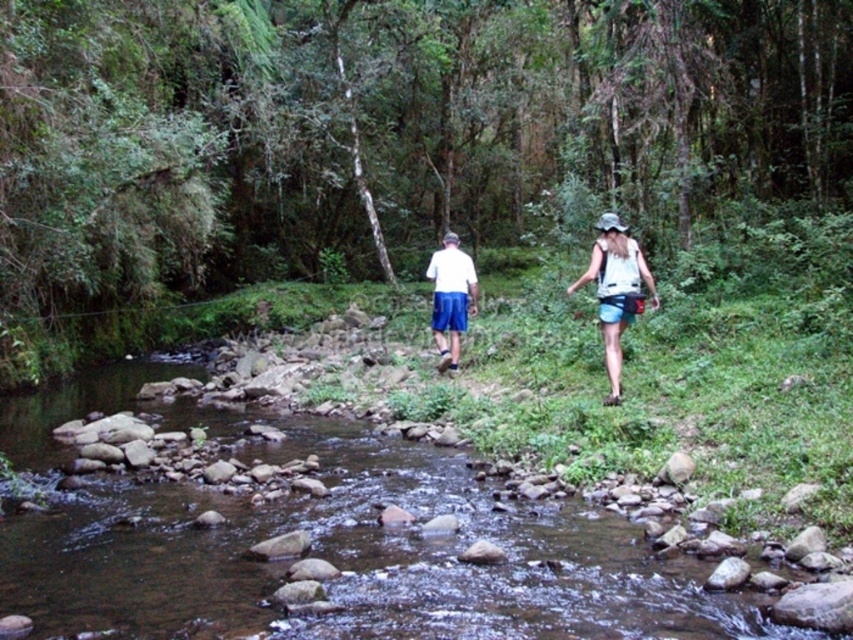
Question: Which object is positioned closest to the white cotton tank top at center?

Choices:
 (A) white matte shorts at center
 (B) white cotton shirt at center

Answer: (B)

Question: Is white cotton shirt at center positioned before white matte shorts at center?

Choices:
 (A) no
 (B) yes

Answer: (B)

Question: Which point is closer to the camera taking this photo?

Choices:
 (A) (602, 401)
 (B) (630, 301)
 (C) (442, 269)
 (D) (602, 525)

Answer: (D)

Question: From the image, what is the correct spatial relationship of white cotton shirt at center in relation to white matte shorts at center?

Choices:
 (A) right
 (B) left

Answer: (A)

Question: Which point is closer to the camera?

Choices:
 (A) white matte shorts at center
 (B) white cotton tank top at center
 (C) clear water at stream center

Answer: (C)

Question: Does clear water at stream center have a greater width compared to white cotton shirt at center?

Choices:
 (A) yes
 (B) no

Answer: (A)